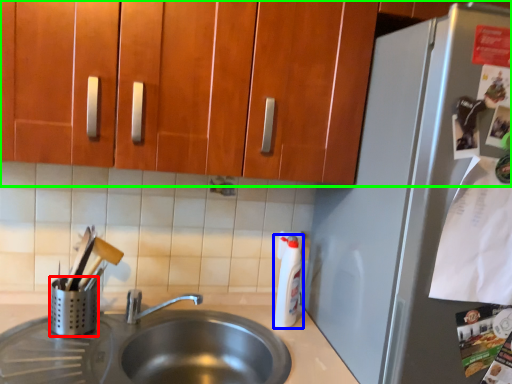
Question: Which is farther away from appliance (highlighted by a red box)? bottle (highlighted by a blue box) or cabinetry (highlighted by a green box)?

Choices:
 (A) bottle
 (B) cabinetry

Answer: (B)